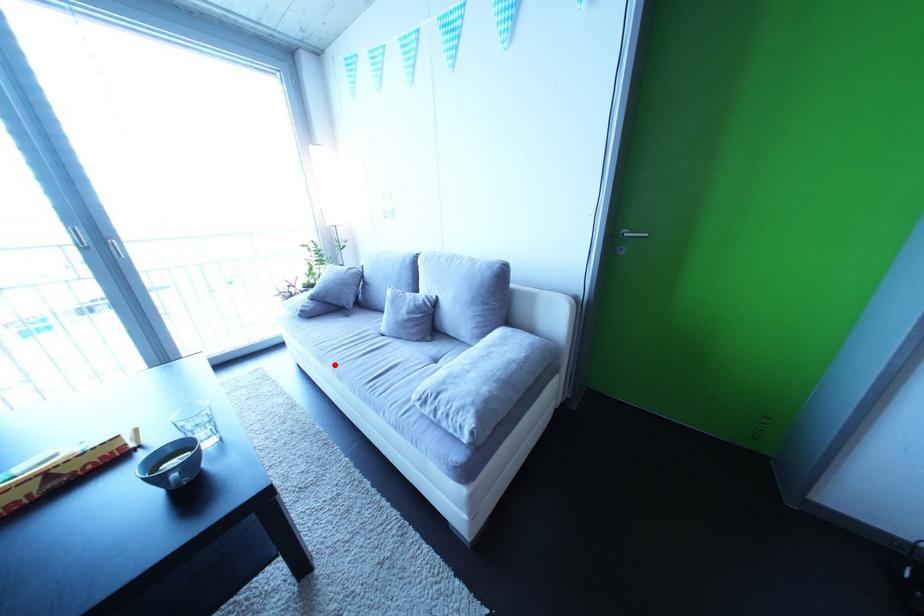
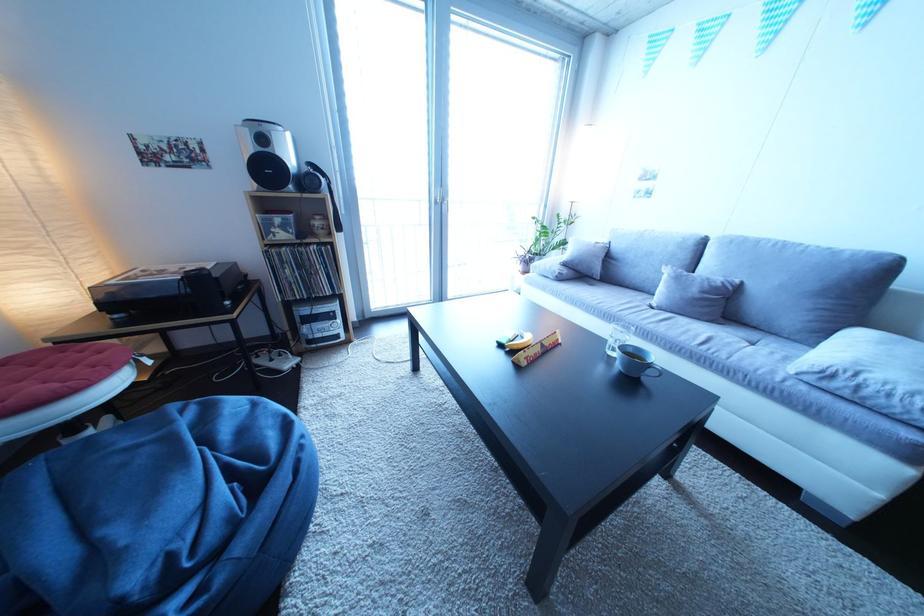
Find the pixel in the second image that matches the highlighted location in the first image.

(622, 323)